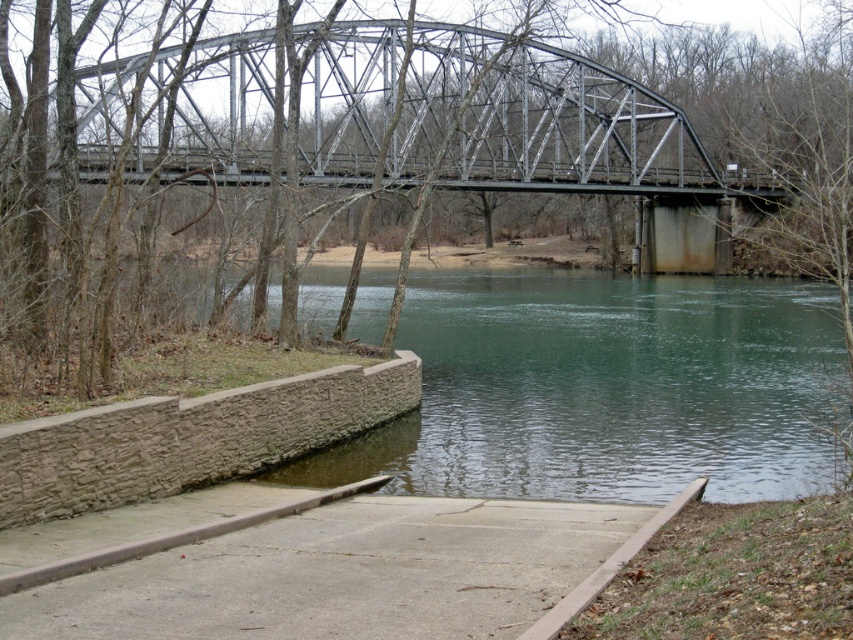
You are standing at the point marked by coordinates point (386,116) in the image. Looking around, what large structure are you directly under?

The metallic gray bridge at upper center is represented by point (386,116), so you are directly under the metallic gray bridge at upper center.

You are a photographer planning to capture the entire view of the metallic gray bridge at upper center and the concrete at center in a single shot. Given that your camera can only focus on one object at a time, which object should you prioritize focusing on to ensure it appears sharp and detailed in the final image?

The metallic gray bridge at upper center is larger in size than concrete at center, so focusing on the metallic gray bridge at upper center would ensure it appears sharp and detailed in the final image.

You are a photographer standing on the metallic gray bridge at upper center and want to take a photo of the concrete at center. Since the bridge is between you and the concrete, will the bridge block your view of the concrete?

The metallic gray bridge at upper center is further to the viewer than concrete at center. So, if you are standing on the metallic gray bridge at upper center, the bridge itself would not block your view of the concrete at center because the concrete is located behind the bridge from your perspective.